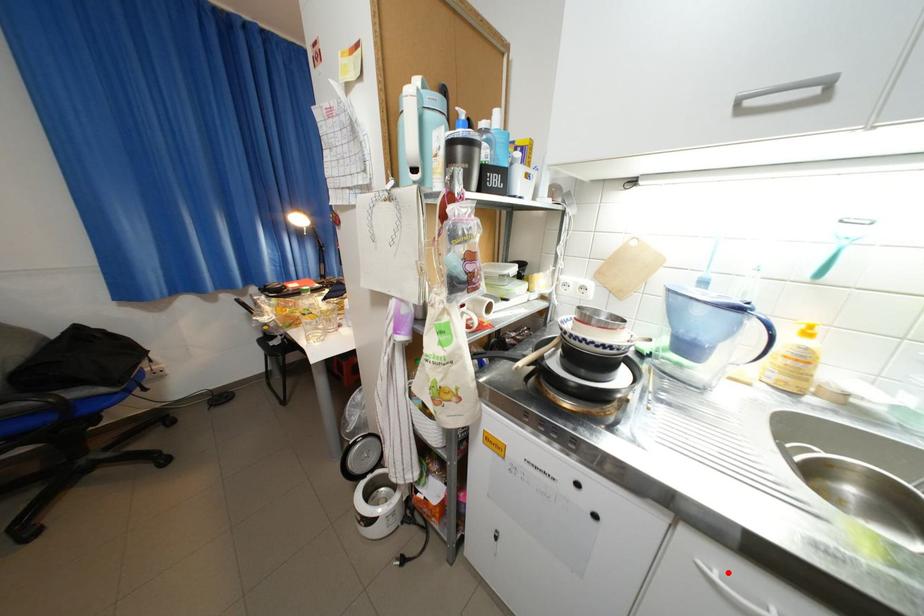
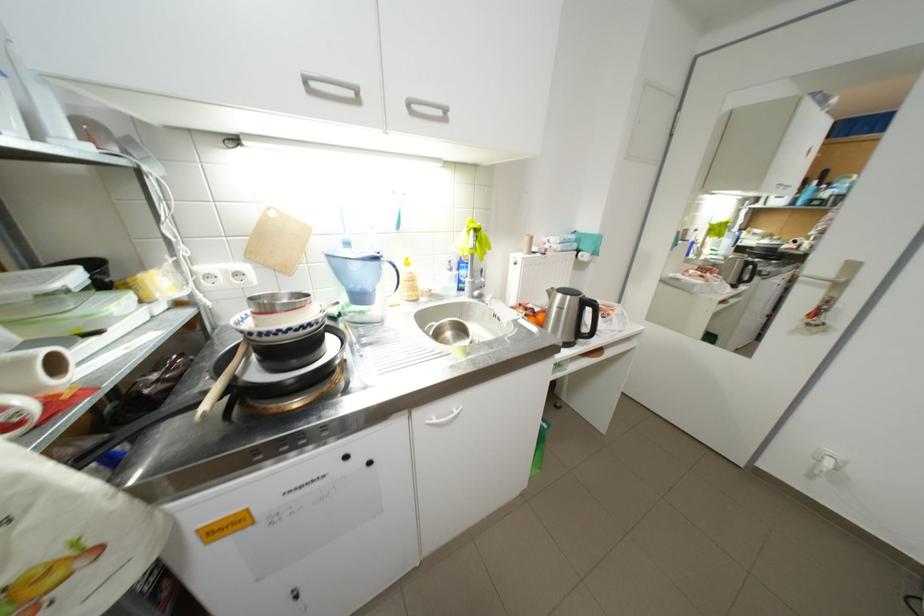
Locate, in the second image, the point that corresponds to the highlighted location in the first image.

(445, 419)